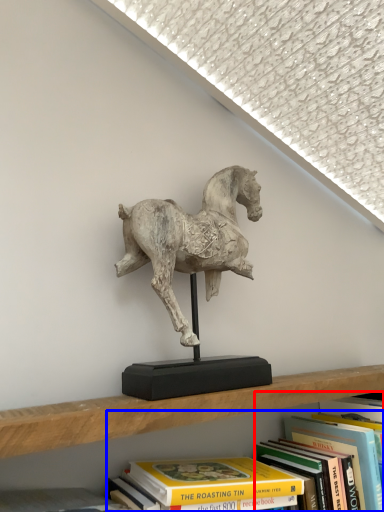
Question: Which object is further to the camera taking this photo, book (highlighted by a red box) or book (highlighted by a blue box)?

Choices:
 (A) book
 (B) book

Answer: (A)